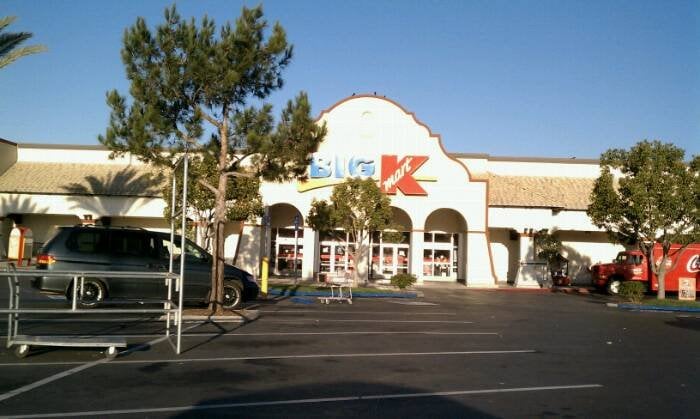
This screenshot has height=419, width=700. What are the coordinates of `entryway` in the screenshot? It's located at 334,255, 395,258.